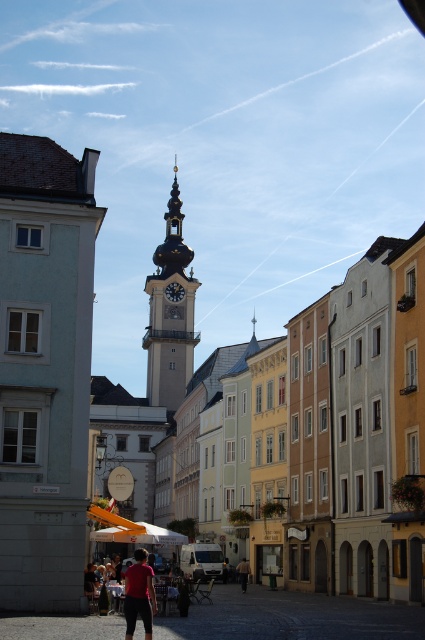
Does matte black pants at center come in front of light brown leather jacket at center?

That is True.

Is matte black pants at center shorter than light brown leather jacket at center?

Incorrect, matte black pants at center's height does not fall short of light brown leather jacket at center's.

Does point (127, 579) come farther from viewer compared to point (243, 586)?

No, it is in front of (243, 586).

You are a GUI agent. You are given a task and a screenshot of the screen. Output one action in this format:
    pyautogui.click(x=<x>, y=<y>)
    Task: Click on the matte black pants at center
    
    Given the screenshot: What is the action you would take?
    pyautogui.click(x=138, y=595)

Is point (186, 310) more distant than point (178, 298)?

No.

Does polished gold clock tower at center have a lesser height compared to gold metallic clock at center?

No.

Does point (153, 376) come farther from viewer compared to point (181, 284)?

No.

The width and height of the screenshot is (425, 640). I want to click on polished gold clock tower at center, so 170,314.

Is polished gold clock tower at center bigger than matte black pants at center?

Indeed, polished gold clock tower at center has a larger size compared to matte black pants at center.

Between polished gold clock tower at center and matte black pants at center, which one has more height?

With more height is polished gold clock tower at center.

Between point (153, 365) and point (139, 609), which one is positioned in front?

Point (139, 609) is more forward.

In order to click on polished gold clock tower at center in this screenshot , I will do `click(170, 314)`.